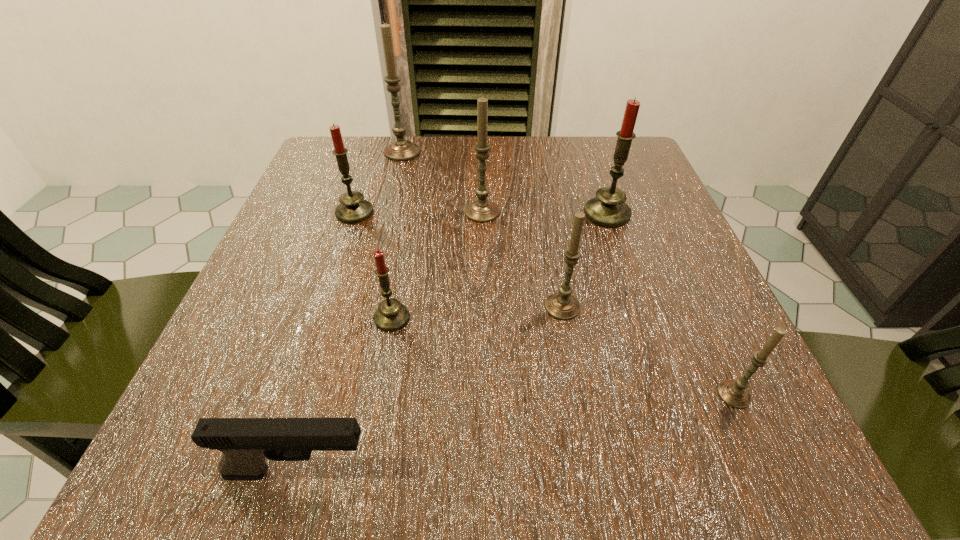
Find the location of a particular element. vacant space located 0.100m on the right of the smallest red candle is located at coordinates (476, 318).

Image resolution: width=960 pixels, height=540 pixels. Find the location of `free space located 0.160m on the back of the nearest candle`. free space located 0.160m on the back of the nearest candle is located at coordinates (687, 292).

Find the location of a particular element. Image resolution: width=960 pixels, height=540 pixels. free space located on the front-facing side of the shortest object is located at coordinates (632, 472).

Image resolution: width=960 pixels, height=540 pixels. In order to click on object that is at the far edge in this screenshot , I will do `click(400, 150)`.

Where is `object at the near edge`? This screenshot has width=960, height=540. object at the near edge is located at coordinates (246, 443).

Image resolution: width=960 pixels, height=540 pixels. I want to click on pistol present at the left edge, so click(x=246, y=443).

In order to click on object at the far left corner in this screenshot , I will do `click(400, 150)`.

Identify the location of object located in the near left corner section of the desktop. (246, 443).

The image size is (960, 540). I want to click on vacant area at the far edge, so click(423, 172).

At what (x,y) coordinates should I click in order to perform the action: click on blank space at the near edge of the desktop. Please return your answer as a coordinate pair (x, y). Image resolution: width=960 pixels, height=540 pixels. Looking at the image, I should click on (615, 461).